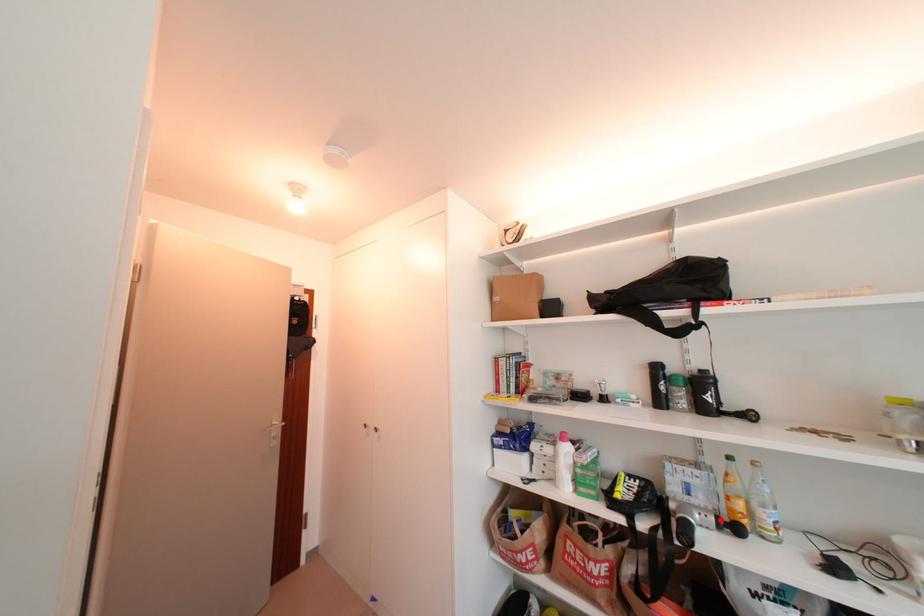
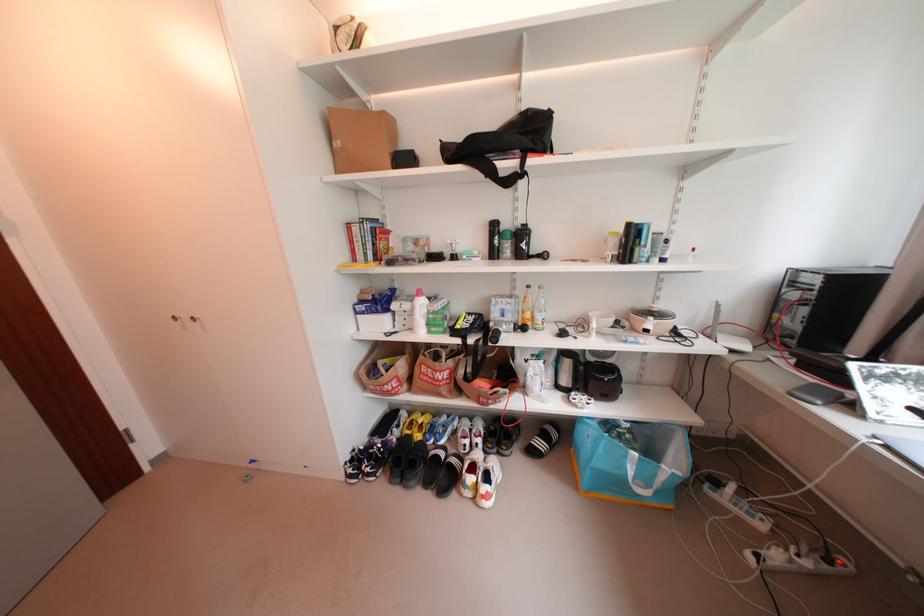
Find the pixel in the second image that matches the highlighted location in the first image.

(520, 326)